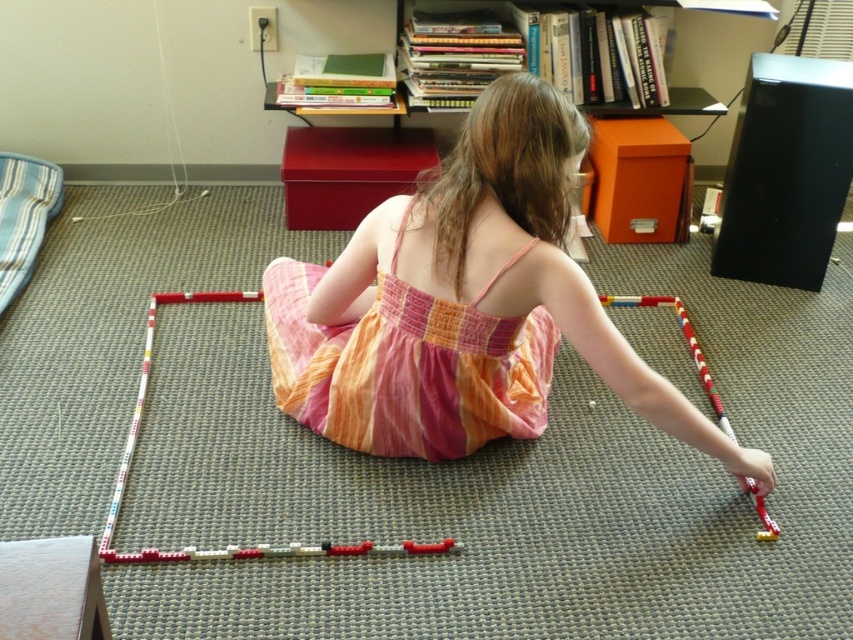
You are a photographer trying to capture the pink cotton dress at center in a photo. If you move your camera slightly to the right, will the dress still be in the frame?

The pink cotton dress at center is located at point (407, 364), which is near the center of the image. Moving the camera slightly to the right would still keep the dress within the frame as it is centrally positioned.

You are helping a child choose an outfit for a playdate. The child has two options in front of them on the carpeted floor. The options are the multicolored fabric dress at center and the pink cotton dress at center. Which dress should the child pick if they want the larger one?

The multicolored fabric dress at center is bigger than the pink cotton dress at center, so the child should pick the multicolored fabric dress at center if they want the larger one.